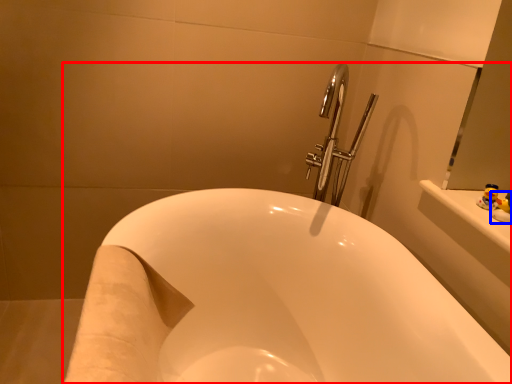
Question: Which point is further to the camera, bathtub (highlighted by a red box) or toy (highlighted by a blue box)?

Choices:
 (A) bathtub
 (B) toy

Answer: (B)